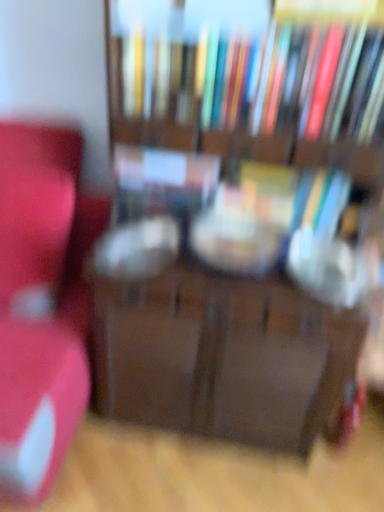
In order to face hardcover books at upper center, the 3th book from the bottom, should I rotate leftwards or rightwards?

To face it directly, rotate right by 7.756 degrees.

Identify the location of hardcover books at upper center, the 3th book from the bottom. point(246,71).

This screenshot has width=384, height=512. Describe the element at coordinates (253, 89) in the screenshot. I see `wooden bookcase at center` at that location.

What is the approximate width of matte plastic book at center, which is the second book in top-to-bottom order?

It is 6.11 inches.

Identify the location of matte red chair at left. Image resolution: width=384 pixels, height=512 pixels. (43, 300).

The image size is (384, 512). Describe the element at coordinates (288, 197) in the screenshot. I see `hardcover book at center, which is the third book from top to bottom` at that location.

Where is `hardcover books at upper center, which ranks as the 1th book in top-to-bottom order`? hardcover books at upper center, which ranks as the 1th book in top-to-bottom order is located at coordinates (246, 71).

Does hardcover book at center, which is the third book from top to bottom, appear on the right side of hardcover books at upper center, which ranks as the 1th book in top-to-bottom order?

Correct, you'll find hardcover book at center, which is the third book from top to bottom, to the right of hardcover books at upper center, which ranks as the 1th book in top-to-bottom order.

At what (x,y) coordinates should I click in order to perform the action: click on the 1st book to the left of the hardcover book at center, which is the third book from top to bottom, starting your count from the anchor. Please return your answer as a coordinate pair (x, y). The width and height of the screenshot is (384, 512). Looking at the image, I should click on (246, 71).

Considering the sizes of objects hardcover book at center, which is the third book from top to bottom, and hardcover books at upper center, the 3th book from the bottom, in the image provided, who is shorter, hardcover book at center, which is the third book from top to bottom, or hardcover books at upper center, the 3th book from the bottom,?

With less height is hardcover book at center, which is the third book from top to bottom.

Is hardcover book at center, arranged as the 1th book when ordered from the bottom, aimed at hardcover books at upper center, the 3th book from the bottom?

No, hardcover book at center, arranged as the 1th book when ordered from the bottom, does not turn towards hardcover books at upper center, the 3th book from the bottom.

Does wooden bookcase at center turn towards hardcover book at center, arranged as the 1th book when ordered from the bottom?

Yes, wooden bookcase at center faces towards hardcover book at center, arranged as the 1th book when ordered from the bottom.

At what (x,y) coordinates should I click in order to perform the action: click on bookcase on the left of hardcover book at center, which is the third book from top to bottom. Please return your answer as a coordinate pair (x, y). Looking at the image, I should click on (253, 89).

Between wooden bookcase at center and hardcover book at center, which is the third book from top to bottom, which one has smaller size?

hardcover book at center, which is the third book from top to bottom.

Is wooden bookcase at center to the left of hardcover book at center, which is the third book from top to bottom, from the viewer's perspective?

Yes.

Is matte red chair at left facing away from matte plastic book at center, which is the 2th book from bottom to top?

No, matte red chair at left's orientation is not away from matte plastic book at center, which is the 2th book from bottom to top.

Are matte red chair at left and matte plastic book at center, which is the 2th book from bottom to top, far apart?

No, matte red chair at left is in close proximity to matte plastic book at center, which is the 2th book from bottom to top.

Consider the image. From the image's perspective, between matte red chair at left and matte plastic book at center, which is the 2th book from bottom to top, which one is located above?

matte plastic book at center, which is the 2th book from bottom to top.

From a real-world perspective, is matte red chair at left positioned over matte plastic book at center, which is the 2th book from bottom to top, based on gravity?

No, from a real-world perspective, matte red chair at left is not above matte plastic book at center, which is the 2th book from bottom to top.

Can hardcover book at center, arranged as the 1th book when ordered from the bottom, be found inside hardcover books at upper center, which ranks as the 1th book in top-to-bottom order?

Definitely not — hardcover book at center, arranged as the 1th book when ordered from the bottom, is not inside hardcover books at upper center, which ranks as the 1th book in top-to-bottom order.

From a real-world perspective, starting from the hardcover books at upper center, which ranks as the 1th book in top-to-bottom order, which book is the 2nd one below it? Please provide its 2D coordinates.

[(288, 197)]

Between hardcover books at upper center, the 3th book from the bottom, and hardcover book at center, which is the third book from top to bottom, which one appears on the right side from the viewer's perspective?

From the viewer's perspective, hardcover book at center, which is the third book from top to bottom, appears more on the right side.

From the image's perspective, is hardcover books at upper center, the 3th book from the bottom, below hardcover book at center, arranged as the 1th book when ordered from the bottom?

No, from the image's perspective, hardcover books at upper center, the 3th book from the bottom, is not beneath hardcover book at center, arranged as the 1th book when ordered from the bottom.

The height and width of the screenshot is (512, 384). Find the location of `furniture lying on the left of wooden bookcase at center`. furniture lying on the left of wooden bookcase at center is located at coordinates [x=43, y=300].

In the image, is wooden bookcase at center positioned in front of or behind matte red chair at left?

wooden bookcase at center is positioned closer to the viewer than matte red chair at left.

Would you say wooden bookcase at center is inside or outside matte red chair at left?

wooden bookcase at center is not inside matte red chair at left, it's outside.

Considering the sizes of wooden bookcase at center and matte red chair at left in the image, is wooden bookcase at center wider or thinner than matte red chair at left?

Clearly, wooden bookcase at center has less width compared to matte red chair at left.

From the image's perspective, is hardcover book at center, arranged as the 1th book when ordered from the bottom, located above or below matte plastic book at center, which is the 2th book from bottom to top?

hardcover book at center, arranged as the 1th book when ordered from the bottom, is situated lower than matte plastic book at center, which is the 2th book from bottom to top, in the image.

Is hardcover book at center, arranged as the 1th book when ordered from the bottom, far from matte plastic book at center, which is the second book in top-to-bottom order?

No, hardcover book at center, arranged as the 1th book when ordered from the bottom, is in close proximity to matte plastic book at center, which is the second book in top-to-bottom order.

Is hardcover book at center, arranged as the 1th book when ordered from the bottom, closer to camera compared to matte plastic book at center, which is the 2th book from bottom to top?

No, it is not.

Could you tell me if hardcover book at center, which is the third book from top to bottom, is facing matte plastic book at center, which is the second book in top-to-bottom order?

No, hardcover book at center, which is the third book from top to bottom, is not turned towards matte plastic book at center, which is the second book in top-to-bottom order.

From the image's perspective, which one is positioned lower, hardcover books at upper center, the 3th book from the bottom, or wooden bookcase at center?

wooden bookcase at center is shown below in the image.

From a real-world perspective, does hardcover books at upper center, the 3th book from the bottom, stand above wooden bookcase at center?

Yes, from a real-world perspective, hardcover books at upper center, the 3th book from the bottom, is on top of wooden bookcase at center.

Between hardcover books at upper center, which ranks as the 1th book in top-to-bottom order, and wooden bookcase at center, which one has smaller size?

Smaller between the two is hardcover books at upper center, which ranks as the 1th book in top-to-bottom order.

Find the location of `the 2nd book above when counting from the hardcover book at center, arranged as the 1th book when ordered from the bottom (from the image's perspective)`. the 2nd book above when counting from the hardcover book at center, arranged as the 1th book when ordered from the bottom (from the image's perspective) is located at coordinates (246, 71).

Where is `bookcase on the left side of hardcover book at center, arranged as the 1th book when ordered from the bottom`? bookcase on the left side of hardcover book at center, arranged as the 1th book when ordered from the bottom is located at coordinates (253, 89).

From the picture: Which object lies further to the anchor point matte plastic book at center, which is the second book in top-to-bottom order, hardcover book at center, arranged as the 1th book when ordered from the bottom, or matte red chair at left?

The object further to matte plastic book at center, which is the second book in top-to-bottom order, is matte red chair at left.

In the scene shown: Considering their positions, is hardcover book at center, arranged as the 1th book when ordered from the bottom, positioned further to hardcover books at upper center, which ranks as the 1th book in top-to-bottom order, than matte plastic book at center, which is the second book in top-to-bottom order?

Among the two, hardcover book at center, arranged as the 1th book when ordered from the bottom, is located further to hardcover books at upper center, which ranks as the 1th book in top-to-bottom order.

Estimate the real-world distances between objects in this image. Which object is closer to matte plastic book at center, which is the second book in top-to-bottom order, hardcover book at center, arranged as the 1th book when ordered from the bottom, or wooden bookcase at center?

wooden bookcase at center is positioned closer to the anchor matte plastic book at center, which is the second book in top-to-bottom order.

Based on their spatial positions, is matte plastic book at center, which is the 2th book from bottom to top, or hardcover book at center, arranged as the 1th book when ordered from the bottom, further from wooden bookcase at center?

Among the two, hardcover book at center, arranged as the 1th book when ordered from the bottom, is located further to wooden bookcase at center.

Considering their positions, is hardcover books at upper center, the 3th book from the bottom, positioned further to hardcover book at center, which is the third book from top to bottom, than wooden bookcase at center?

hardcover books at upper center, the 3th book from the bottom, lies further to hardcover book at center, which is the third book from top to bottom, than the other object.

Based on their spatial positions, is hardcover book at center, which is the third book from top to bottom, or matte plastic book at center, which is the second book in top-to-bottom order, further from matte red chair at left?

hardcover book at center, which is the third book from top to bottom, lies further to matte red chair at left than the other object.

From the image, which object appears to be farther from matte plastic book at center, which is the second book in top-to-bottom order, hardcover books at upper center, which ranks as the 1th book in top-to-bottom order, or hardcover book at center, arranged as the 1th book when ordered from the bottom?

Based on the image, hardcover book at center, arranged as the 1th book when ordered from the bottom, appears to be further to matte plastic book at center, which is the second book in top-to-bottom order.

Based on their spatial positions, is hardcover book at center, arranged as the 1th book when ordered from the bottom, or matte red chair at left further from hardcover books at upper center, which ranks as the 1th book in top-to-bottom order?

matte red chair at left.

Image resolution: width=384 pixels, height=512 pixels. What are the coordinates of `bookcase situated between matte red chair at left and hardcover book at center, which is the third book from top to bottom, from left to right` in the screenshot? It's located at (253, 89).

This screenshot has height=512, width=384. I want to click on book located between matte red chair at left and wooden bookcase at center in the left-right direction, so click(162, 180).

You are a GUI agent. You are given a task and a screenshot of the screen. Output one action in this format:
    pyautogui.click(x=<x>, y=<y>)
    Task: Click on the book between matte red chair at left and hardcover books at upper center, the 3th book from the bottom
    This screenshot has width=384, height=512.
    Given the screenshot: What is the action you would take?
    pyautogui.click(x=162, y=180)

Locate an element on the screen. book located between matte plastic book at center, which is the 2th book from bottom to top, and hardcover book at center, arranged as the 1th book when ordered from the bottom, in the left-right direction is located at coordinates (246, 71).